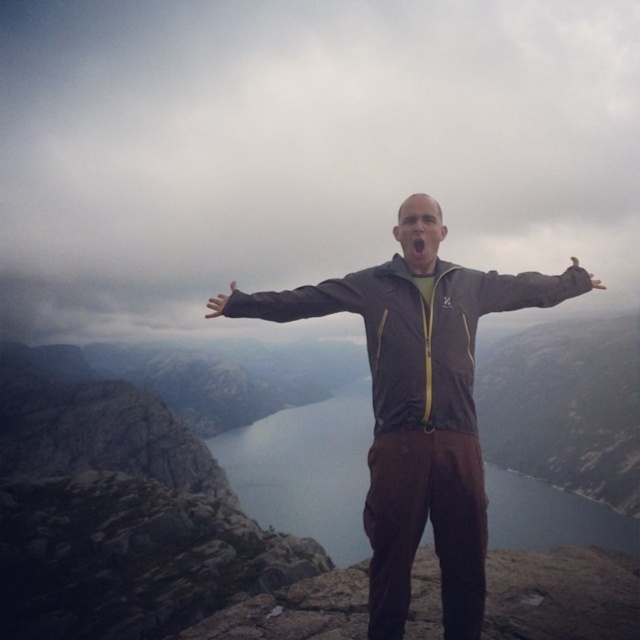
Question: Can you confirm if brown fabric arm at center is positioned below matte brown hand at center?

Choices:
 (A) yes
 (B) no

Answer: (A)

Question: Which is nearer to the brown matte jacket at center?

Choices:
 (A) dark gray fabric arm at center
 (B) brown leather glove at upper right

Answer: (A)

Question: Does brown fabric arm at center have a greater width compared to matte brown hand at center?

Choices:
 (A) yes
 (B) no

Answer: (B)

Question: Estimate the real-world distances between objects in this image. Which object is closer to the dark gray fabric arm at center?

Choices:
 (A) matte brown hand at center
 (B) matte brown jacket at center
 (C) brown fabric arm at center

Answer: (B)

Question: Which point appears closest to the camera in this image?

Choices:
 (A) (218, 312)
 (B) (577, 266)
 (C) (371, 276)
 (D) (456, 291)

Answer: (A)

Question: Does smooth blue water at center have a greater width compared to brown fabric arm at center?

Choices:
 (A) no
 (B) yes

Answer: (B)